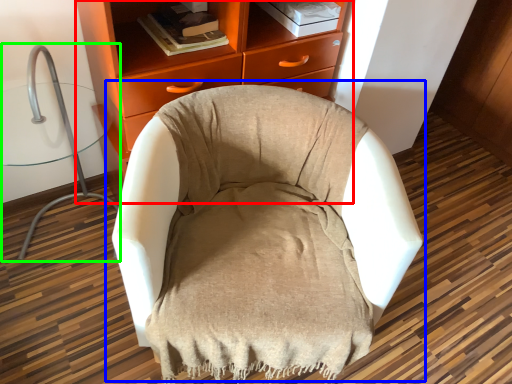
Question: Based on their relative distances, which object is nearer to chest of drawers (highlighted by a red box)? Choose from chair (highlighted by a blue box) and computer chair (highlighted by a green box).

Choices:
 (A) chair
 (B) computer chair

Answer: (A)